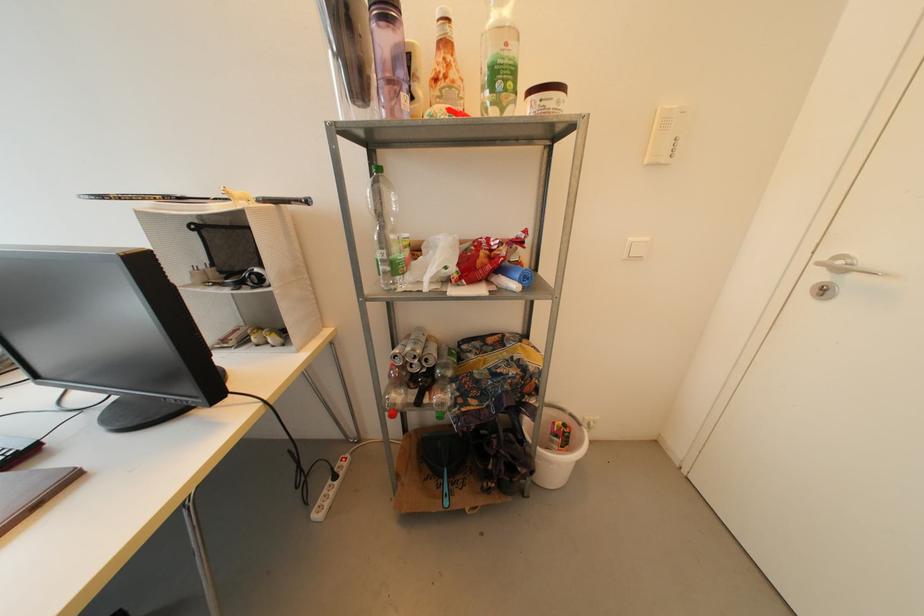
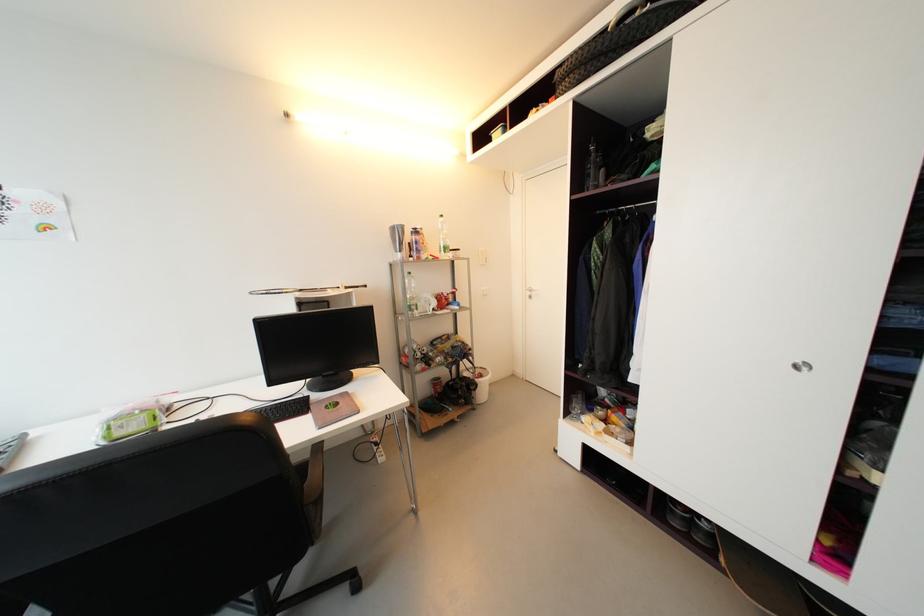
Find the pixel in the second image that matches the point at 823,278 in the first image.

(533, 294)